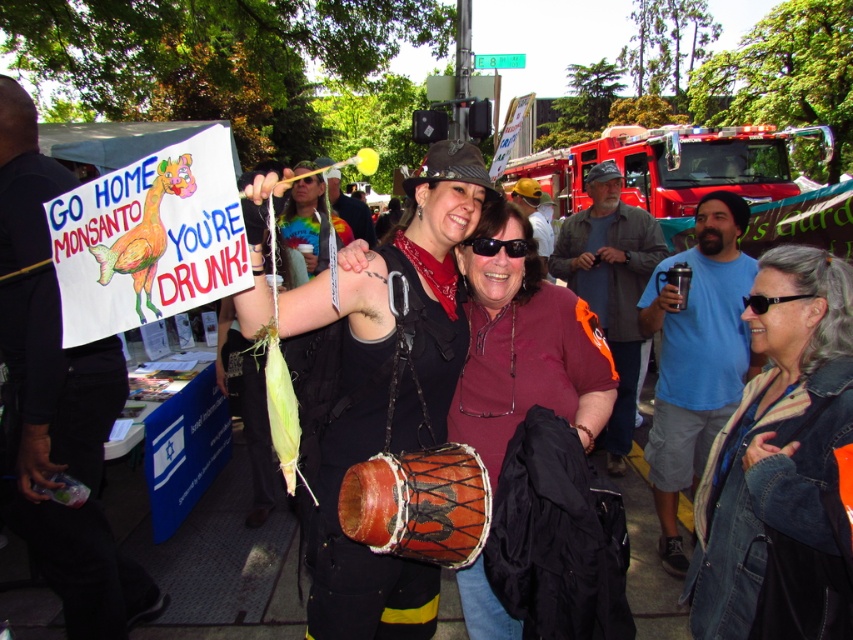
Question: Can you confirm if denim jacket at lower right is wider than red metallic fire truck at upper right?

Choices:
 (A) yes
 (B) no

Answer: (B)

Question: Which object appears farthest from the camera in this image?

Choices:
 (A) matte black drum at center
 (B) blue cotton t-shirt at right
 (C) maroon fabric shirt at center

Answer: (B)

Question: Which point appears farthest from the camera in this image?

Choices:
 (A) (732, 128)
 (B) (370, 237)
 (C) (369, 536)
 (D) (70, 412)

Answer: (A)

Question: Does red metallic fire truck at upper right have a lesser width compared to leather drum at center?

Choices:
 (A) yes
 (B) no

Answer: (B)

Question: Which point appears farthest from the camera in this image?

Choices:
 (A) (506, 236)
 (B) (820, 365)
 (C) (241, 292)
 (D) (602, 189)

Answer: (D)

Question: Can you confirm if matte black drum at center is positioned below matte yellow balloon at center?

Choices:
 (A) yes
 (B) no

Answer: (A)